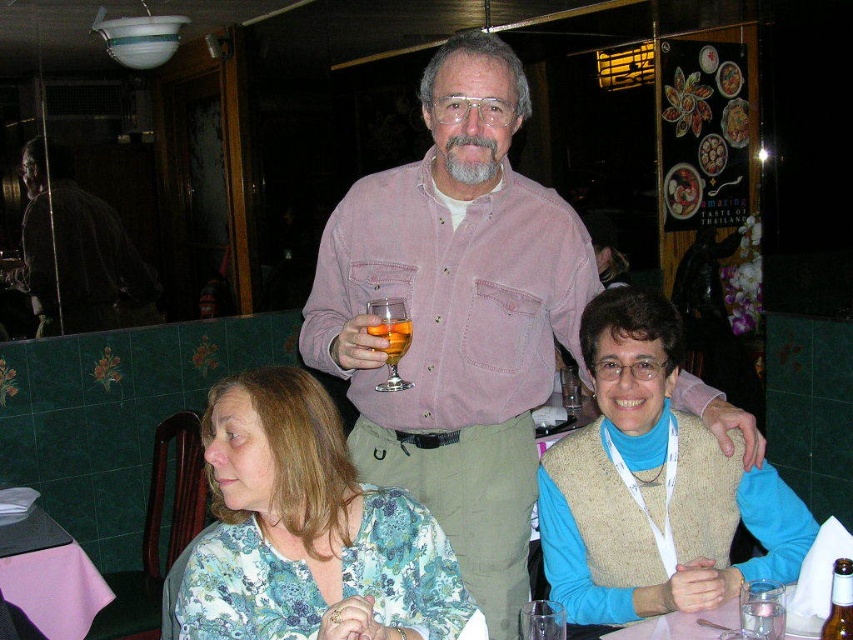
Between pink cotton shirt at center and floral print blouse at lower left, which one is positioned higher?

Positioned higher is pink cotton shirt at center.

Can you confirm if pink cotton shirt at center is positioned to the right of floral print blouse at lower left?

Correct, you'll find pink cotton shirt at center to the right of floral print blouse at lower left.

Between point (520, 465) and point (248, 637), which one is positioned behind?

The point (520, 465) is more distant.

Locate an element on the screen. This screenshot has height=640, width=853. pink cotton shirt at center is located at coordinates [456, 316].

Which is in front, point (373, 308) or point (376, 326)?

Point (376, 326) is more forward.

Can you confirm if translucent glass wine glass at center is positioned to the left of translucent glass at upper center?

Indeed, translucent glass wine glass at center is positioned on the left side of translucent glass at upper center.

This screenshot has width=853, height=640. What do you see at coordinates (392, 337) in the screenshot?
I see `translucent glass wine glass at center` at bounding box center [392, 337].

Find the location of a particular element. This screenshot has height=640, width=853. translucent glass wine glass at center is located at coordinates (392, 337).

Measure the distance between pink cotton shirt at center and camera.

1.56 meters

Does pink cotton shirt at center appear on the left side of translucent glass wine glass at center?

In fact, pink cotton shirt at center is to the right of translucent glass wine glass at center.

Who is more forward, (360, 436) or (399, 355)?

Point (399, 355) is in front.

This screenshot has width=853, height=640. I want to click on pink cotton shirt at center, so click(456, 316).